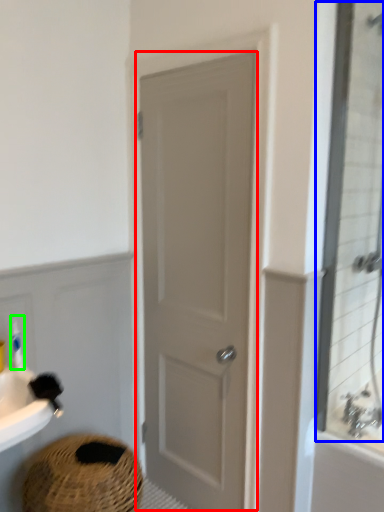
Question: Which is nearer to the door (highlighted by a red box)? mirror (highlighted by a blue box) or toiletry (highlighted by a green box).

Choices:
 (A) mirror
 (B) toiletry

Answer: (A)